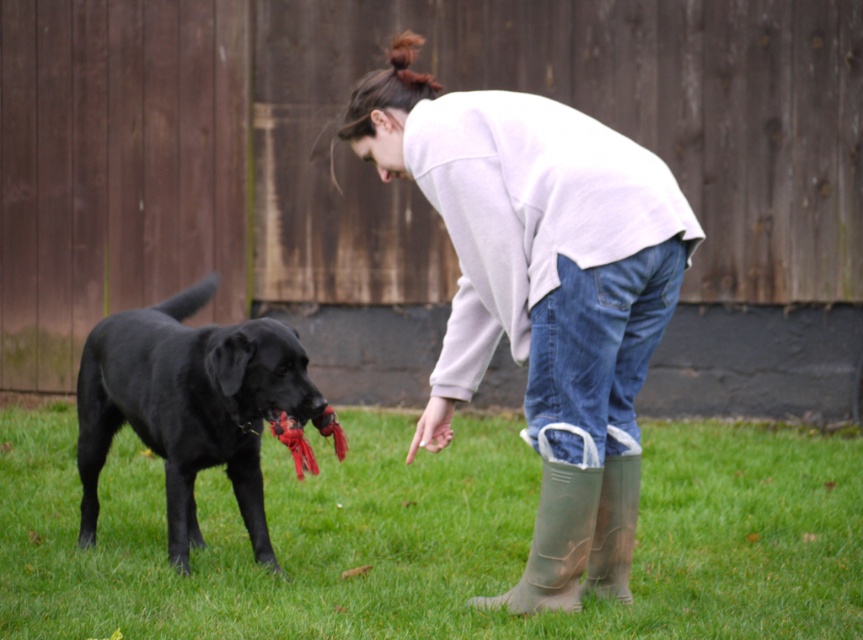
Question: Which object appears farthest from the camera in this image?

Choices:
 (A) rubber boots at lower right
 (B) green rubber boot at lower center

Answer: (A)

Question: Among these points, which one is nearest to the camera?

Choices:
 (A) (465, 492)
 (B) (572, 570)
 (C) (632, 449)
 (D) (630, 497)

Answer: (B)

Question: Is white cotton sweatshirt at center to the left of green rubber boot at lower center from the viewer's perspective?

Choices:
 (A) yes
 (B) no

Answer: (A)

Question: Which object is farther from the camera taking this photo?

Choices:
 (A) green grass at lower center
 (B) green rubber boot at lower center

Answer: (A)

Question: Can you confirm if white cotton sweatshirt at center is thinner than rubber boots at lower right?

Choices:
 (A) no
 (B) yes

Answer: (A)

Question: Is shiny black dog at left wider than rubber boots at lower right?

Choices:
 (A) no
 (B) yes

Answer: (B)